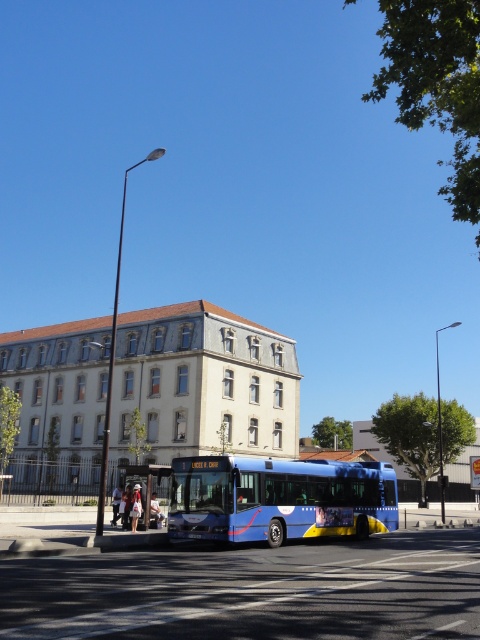
You are a city planner analyzing the layout of this urban area. The blue metallic bus at center is parked at the metallic bus stop at lower left. Considering their widths, which one is narrower?

The blue metallic bus at center has a lesser width compared to the metallic bus stop at lower left, so the blue metallic bus at center is narrower.